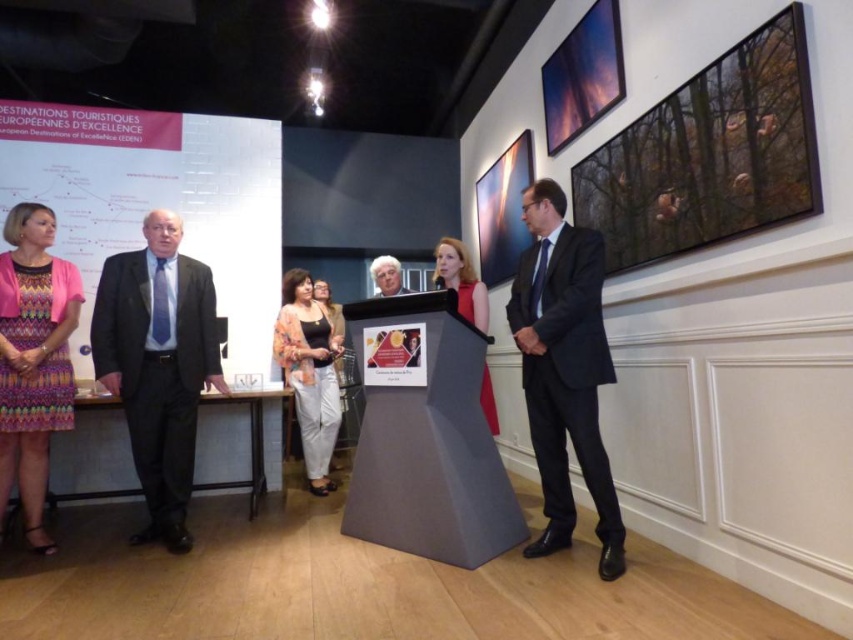
You are an event planner looking at the image of the event setup. You need to hang a new banner between the metallic glass picture frame at upper center and the metallic silver picture frame at upper center. Which frame should the banner be placed above?

The metallic glass picture frame at upper center is above the metallic silver picture frame at upper center, so the banner should be placed above the metallic silver picture frame at upper center.